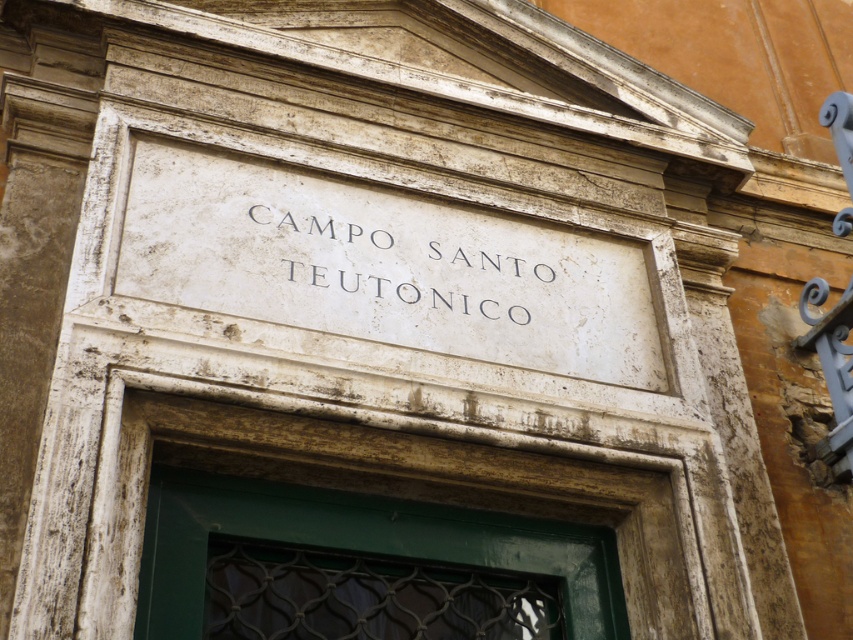
Question: Does white marble sign at center appear over white stone sign at center?

Choices:
 (A) no
 (B) yes

Answer: (A)

Question: Which object is farther from the camera taking this photo?

Choices:
 (A) white marble sign at center
 (B) white stone sign at center

Answer: (B)

Question: Does white marble sign at center have a smaller size compared to white stone sign at center?

Choices:
 (A) no
 (B) yes

Answer: (A)

Question: Which object is closer to the camera taking this photo?

Choices:
 (A) white marble sign at center
 (B) white stone sign at center

Answer: (A)

Question: Is white marble sign at center further to the viewer compared to white stone sign at center?

Choices:
 (A) no
 (B) yes

Answer: (A)